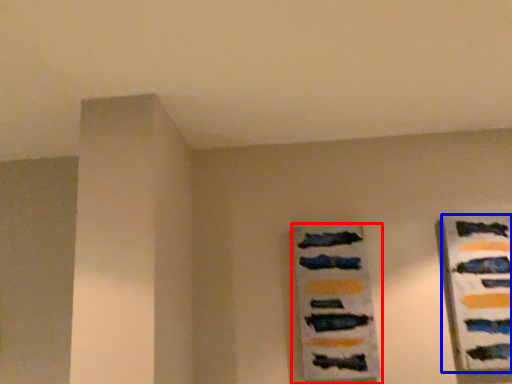
Question: Among these objects, which one is farthest to the camera, picture frame (highlighted by a red box) or design (highlighted by a blue box)?

Choices:
 (A) picture frame
 (B) design

Answer: (A)